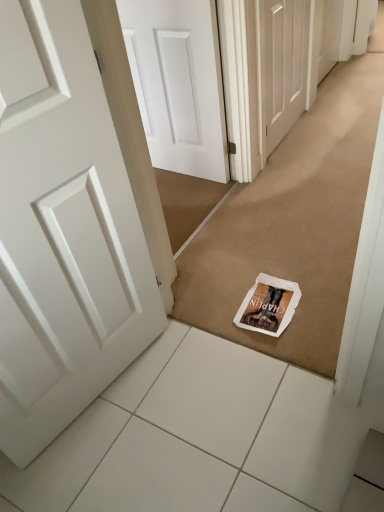
Question: Based on their sizes in the image, would you say white matte door at center, positioned as the 1th door in back-to-front order, is bigger or smaller than white paper magazine at center?

Choices:
 (A) big
 (B) small

Answer: (A)

Question: From the image's perspective, relative to white paper magazine at center, is white matte door at center, marked as the 1th door in a right-to-left arrangement, above or below?

Choices:
 (A) below
 (B) above

Answer: (B)

Question: Based on their relative distances, which object is farther from the white matte door at left, the 2th door when ordered from top to bottom?

Choices:
 (A) white tile at lower center
 (B) white paper magazine at center
 (C) white paper doormat at center
 (D) white matte door at center, positioned as the 1th door in back-to-front order

Answer: (D)

Question: Based on their relative distances, which object is nearer to the white matte door at left, positioned as the 1th door in bottom-to-top order?

Choices:
 (A) white tile at lower center
 (B) white paper doormat at center
 (C) white paper magazine at center
 (D) white matte door at center, arranged as the 1th door when viewed from the top

Answer: (A)